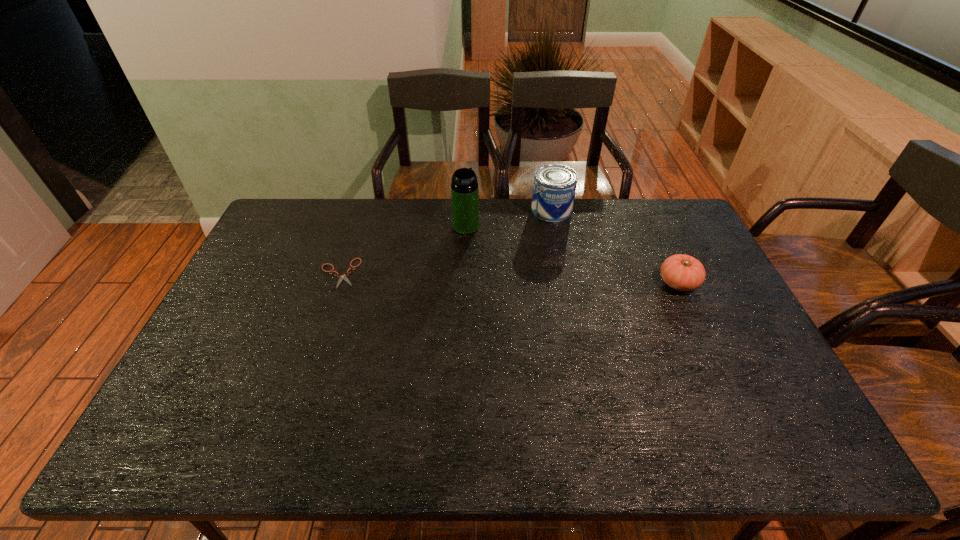
Locate an element on the screen. The height and width of the screenshot is (540, 960). the leftmost object is located at coordinates tap(342, 277).

At what (x,y) coordinates should I click in order to perform the action: click on shears. Please return your answer as a coordinate pair (x, y). The image size is (960, 540). Looking at the image, I should click on (342, 277).

Locate an element on the screen. the second shortest object is located at coordinates [x=681, y=272].

Where is `tomato`? tomato is located at coordinates (681, 272).

At what (x,y) coordinates should I click in order to perform the action: click on the tallest object. Please return your answer as a coordinate pair (x, y). Looking at the image, I should click on (464, 187).

At what (x,y) coordinates should I click in order to perform the action: click on thermos bottle. Please return your answer as a coordinate pair (x, y). Looking at the image, I should click on point(464,187).

Locate an element on the screen. can is located at coordinates (554, 187).

Where is `the second object from right to left`? the second object from right to left is located at coordinates (554, 187).

Locate an element on the screen. The width and height of the screenshot is (960, 540). vacant space located on the left of the leftmost object is located at coordinates (266, 273).

At what (x,y) coordinates should I click in order to perform the action: click on vacant space situated 0.220m on the back of the second shortest object. Please return your answer as a coordinate pair (x, y). This screenshot has width=960, height=540. Looking at the image, I should click on (652, 227).